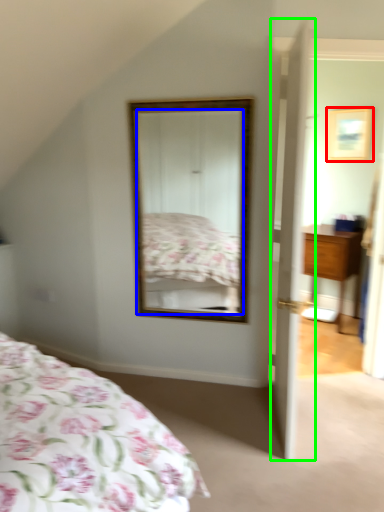
Question: Based on their relative distances, which object is farther from picture frame (highlighted by a red box)? Choose from mirror (highlighted by a blue box) and door (highlighted by a green box).

Choices:
 (A) mirror
 (B) door

Answer: (B)